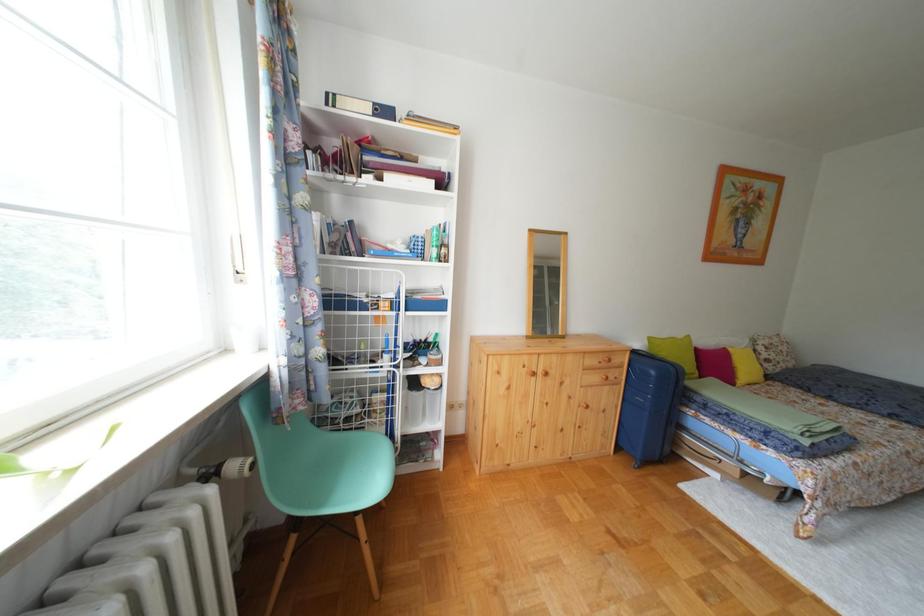
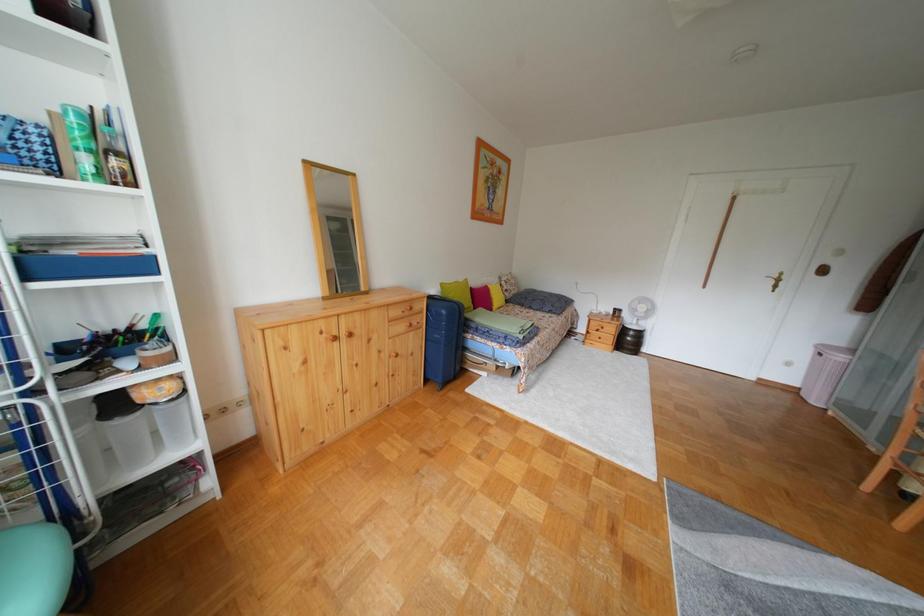
Question: How did the camera likely rotate?

Choices:
 (A) Left
 (B) Right
 (C) Up
 (D) Down

Answer: (B)